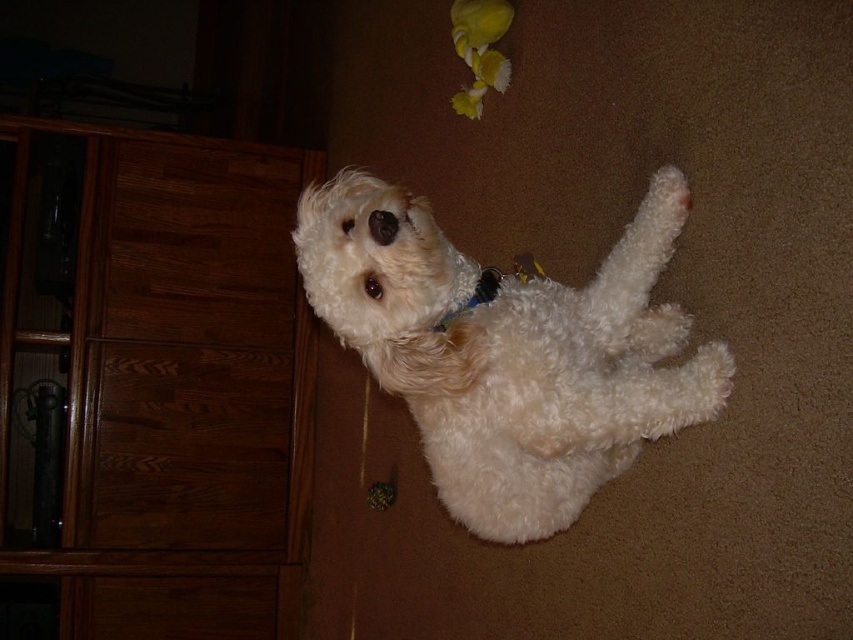
Question: Which object appears closest to the camera in this image?

Choices:
 (A) white fluffy dog at center
 (B) brown wood dresser at left

Answer: (A)

Question: Is brown wood dresser at left to the left of white fluffy dog at center from the viewer's perspective?

Choices:
 (A) no
 (B) yes

Answer: (B)

Question: Considering the relative positions of brown wood dresser at left and white fluffy dog at center in the image provided, where is brown wood dresser at left located with respect to white fluffy dog at center?

Choices:
 (A) below
 (B) above

Answer: (A)

Question: Can you confirm if brown wood dresser at left is wider than white fluffy dog at center?

Choices:
 (A) no
 (B) yes

Answer: (B)

Question: Which point is farther to the camera?

Choices:
 (A) brown wood dresser at left
 (B) white fluffy dog at center

Answer: (A)

Question: Which object appears closest to the camera in this image?

Choices:
 (A) brown wood dresser at left
 (B) white fluffy dog at center

Answer: (B)